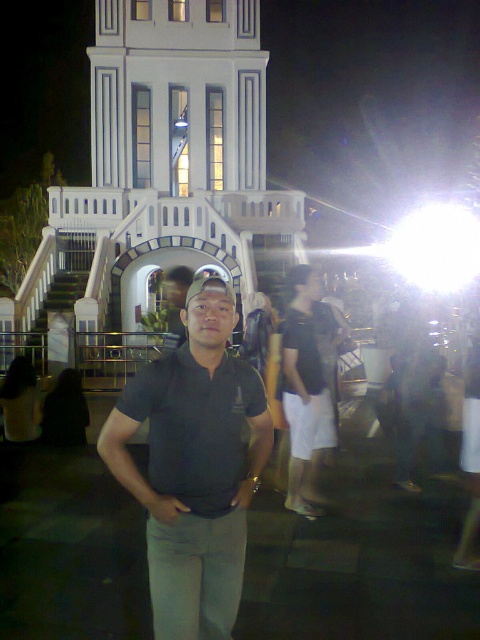
Question: Can you confirm if white smooth tower at center is positioned to the right of matte black polo shirt at center?

Choices:
 (A) yes
 (B) no

Answer: (B)

Question: Is matte black polo shirt at center to the left of dark gray cotton polo shirt at center from the viewer's perspective?

Choices:
 (A) yes
 (B) no

Answer: (A)

Question: Which of the following is the farthest from the observer?

Choices:
 (A) white smooth tower at center
 (B) matte black polo shirt at center

Answer: (A)

Question: Which object is the closest to the dark gray cotton polo shirt at center?

Choices:
 (A) matte black polo shirt at center
 (B) white smooth tower at center

Answer: (A)

Question: Which point appears closest to the camera in this image?

Choices:
 (A) (193, 586)
 (B) (172, 460)
 (C) (194, 49)

Answer: (A)

Question: Can you confirm if matte black polo shirt at center is positioned below dark gray cotton polo shirt at center?

Choices:
 (A) yes
 (B) no

Answer: (B)